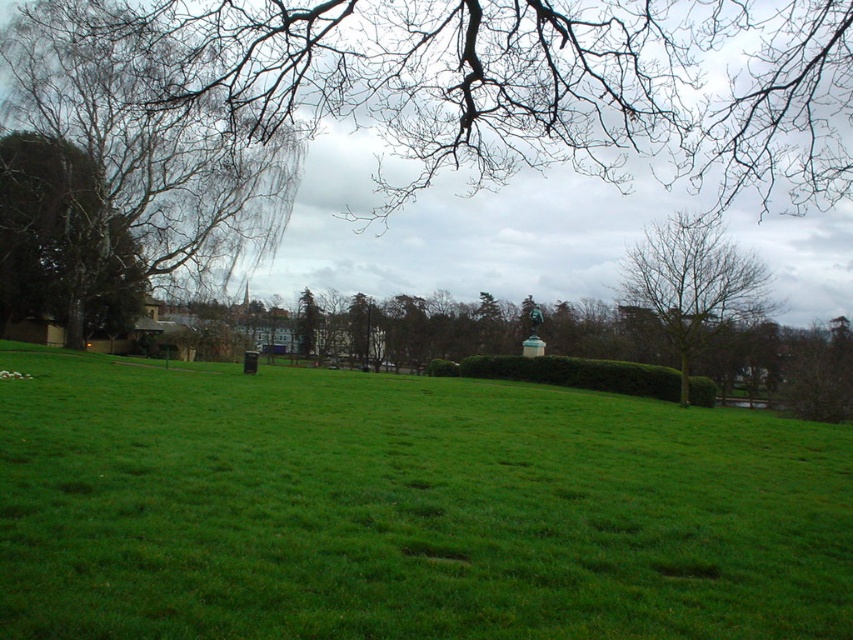
Does bare branches at upper center have a smaller size compared to bare branches at upper right?

No.

Is bare branches at upper center taller than bare branches at upper right?

Yes.

You are a GUI agent. You are given a task and a screenshot of the screen. Output one action in this format:
    pyautogui.click(x=<x>, y=<y>)
    Task: Click on the bare branches at upper center
    The image size is (853, 640).
    Given the screenshot: What is the action you would take?
    pyautogui.click(x=544, y=84)

Image resolution: width=853 pixels, height=640 pixels. I want to click on bare branches at upper center, so click(544, 84).

Is green grassy at center further to camera compared to green leafy hedge at center?

No, it is in front of green leafy hedge at center.

Is point (810, 529) farther from viewer compared to point (467, 376)?

No, (810, 529) is closer to viewer.

This screenshot has width=853, height=640. I want to click on green grassy at center, so click(405, 509).

Between point (828, 424) and point (109, 259), which one is positioned behind?

Point (109, 259)

Who is higher up, green grassy at center or green leafy tree at left?

green leafy tree at left is higher up.

The image size is (853, 640). In order to click on green grassy at center in this screenshot , I will do `click(405, 509)`.

Where is `green grassy at center`? The height and width of the screenshot is (640, 853). green grassy at center is located at coordinates (405, 509).